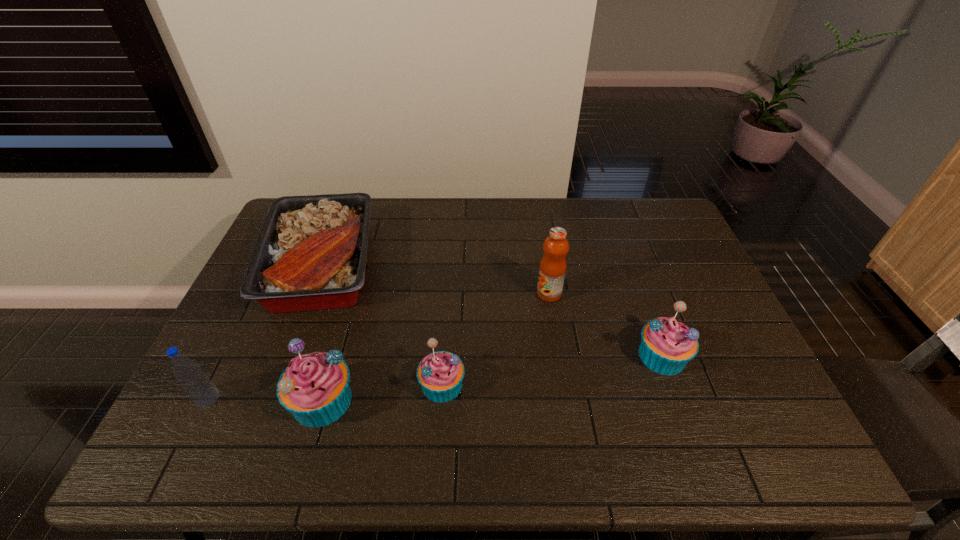
Where is `free space between the water bottle and the fruit juice`? free space between the water bottle and the fruit juice is located at coordinates (378, 346).

The height and width of the screenshot is (540, 960). Find the location of `vacant area that lies between the rightmost muffin and the tray`. vacant area that lies between the rightmost muffin and the tray is located at coordinates (492, 310).

This screenshot has width=960, height=540. Identify the location of vacant area between the rightmost muffin and the tray. (492, 310).

The height and width of the screenshot is (540, 960). What are the coordinates of `free spot between the rightmost object and the fruit juice` in the screenshot? It's located at (606, 325).

Identify which object is the fourth nearest to the fourth object from left to right. Please provide its 2D coordinates. Your answer should be formatted as a tuple, i.e. [(x, y)], where the tuple contains the x and y coordinates of a point satisfying the conditions above.

[(667, 345)]

Where is `the fourth closest object to the fruit juice`? the fourth closest object to the fruit juice is located at coordinates (314, 387).

The height and width of the screenshot is (540, 960). In order to click on muffin that is the second closest one to the tray in this screenshot , I will do `click(440, 374)`.

Locate which muffin ranks third in proximity to the water bottle. Please provide its 2D coordinates. Your answer should be formatted as a tuple, i.e. [(x, y)], where the tuple contains the x and y coordinates of a point satisfying the conditions above.

[(667, 345)]

I want to click on free space that satisfies the following two spatial constraints: 1. on the front label of the rightmost object; 2. on the right side of the tallest object, so click(x=559, y=356).